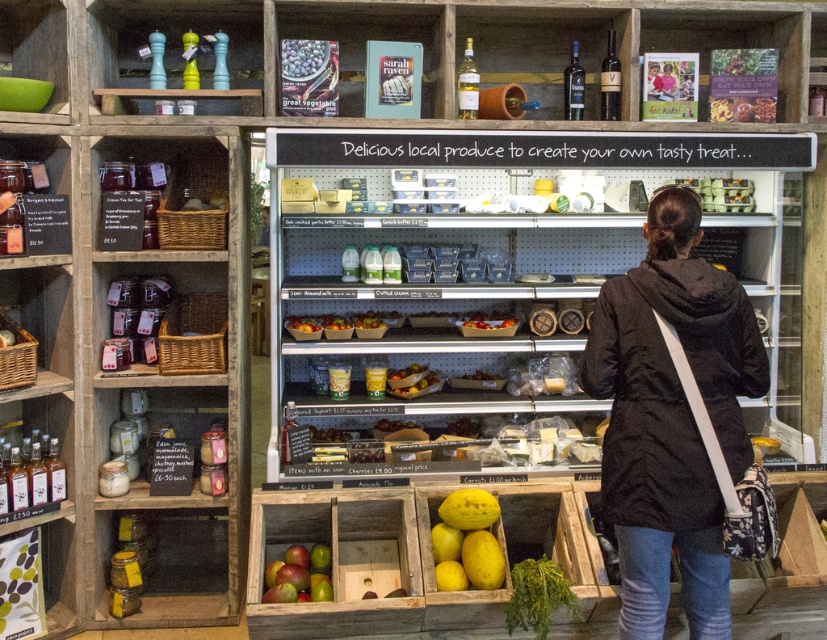
Question: Considering the real-world distances, which object is farthest from the clear plastic shelves at center?

Choices:
 (A) shiny metallic olives at center
 (B) green leafy vegetable at lower center
 (C) mangoes at lower center

Answer: (B)

Question: Which object is positioned farthest from the yellow matte melon at lower center?

Choices:
 (A) clear plastic shelves at center
 (B) matte plastic salt and pepper shakers at upper left
 (C) mangoes at lower center
 (D) black fabric coat at center

Answer: (B)

Question: Which point is closer to the camera?

Choices:
 (A) mangoes at lower center
 (B) green matte bowl at upper left
 (C) clear plastic shelves at center
 (D) matte plastic salt and pepper shakers at upper left

Answer: (A)

Question: Is matte plastic salt and pepper shakers at upper left above shiny metallic olives at center?

Choices:
 (A) no
 (B) yes

Answer: (B)

Question: In this image, where is green leafy vegetable at lower center located relative to mangoes at lower center?

Choices:
 (A) right
 (B) left

Answer: (A)

Question: Is yellow matte melon at lower center positioned in front of shiny metallic olives at center?

Choices:
 (A) no
 (B) yes

Answer: (B)